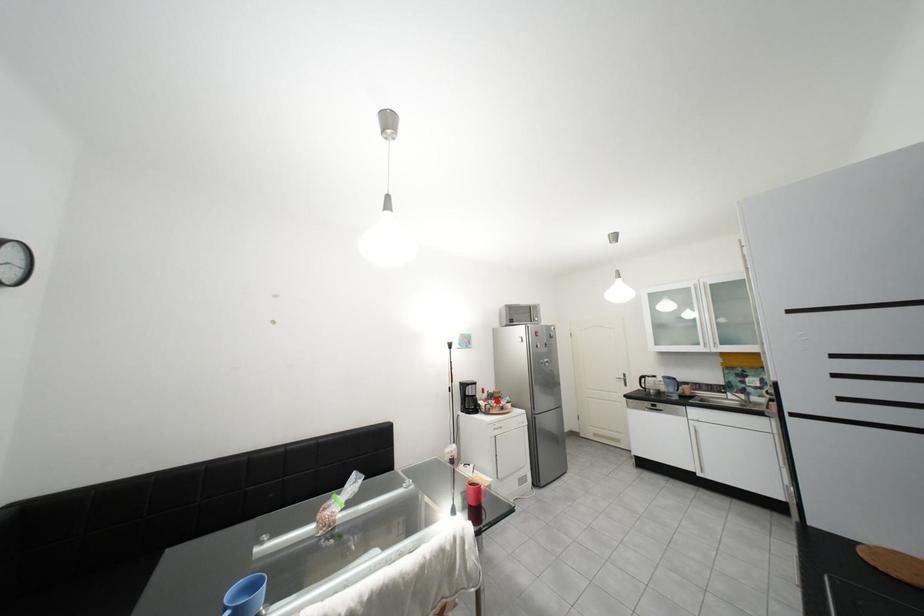
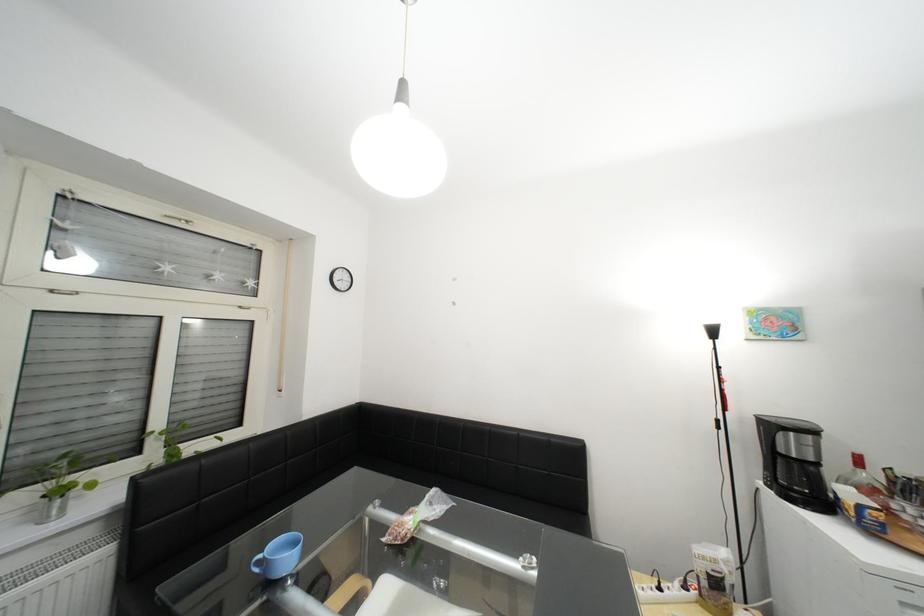
Question: I am providing you with two images of the same scene from different viewpoints. Image1 has a red point marked. In image2, the corresponding 3D location appears at what relative position? Reply with the corresponding letter.

Choices:
 (A) Closer
 (B) Farther

Answer: (A)